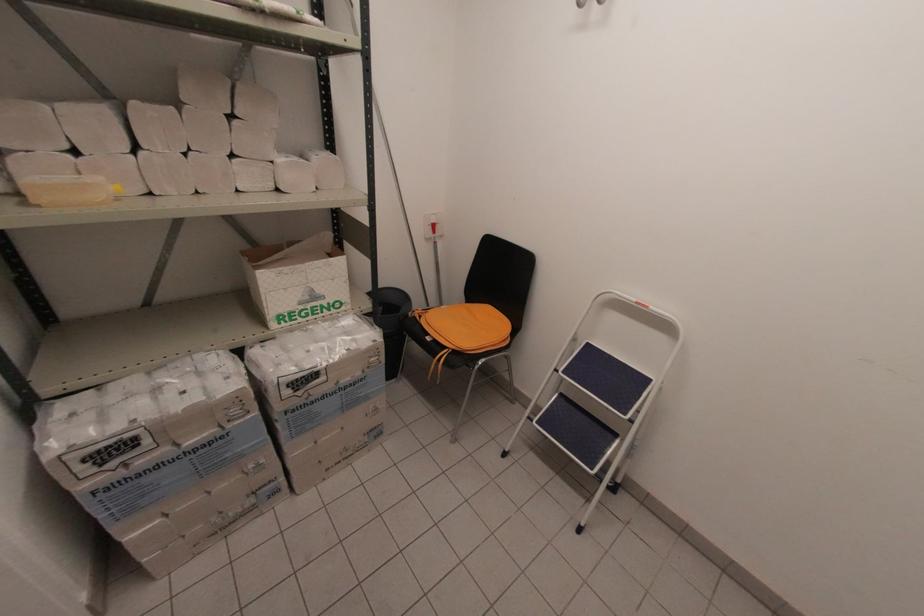
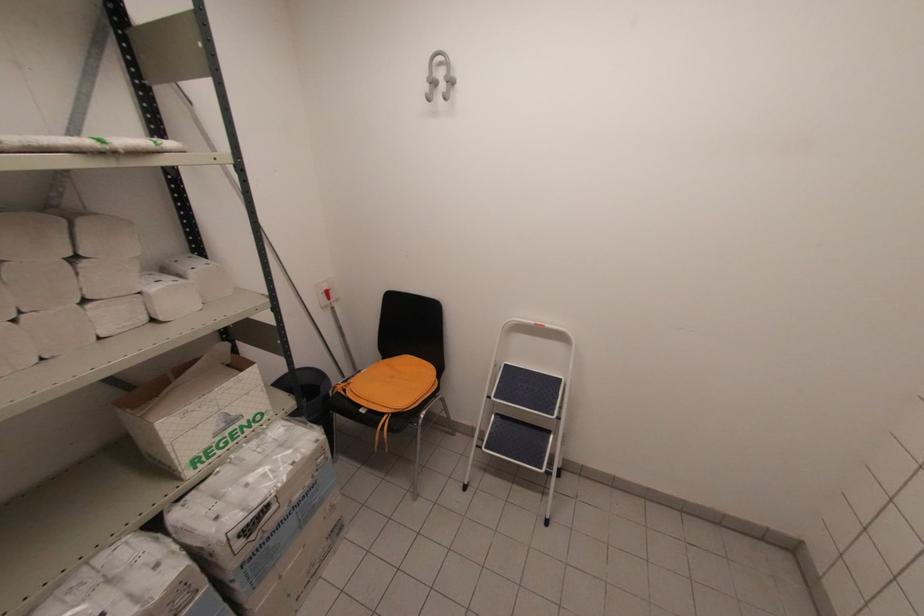
In a continuous first-person perspective shot, in which direction is the camera moving?

The cameraman walked toward left, backward.